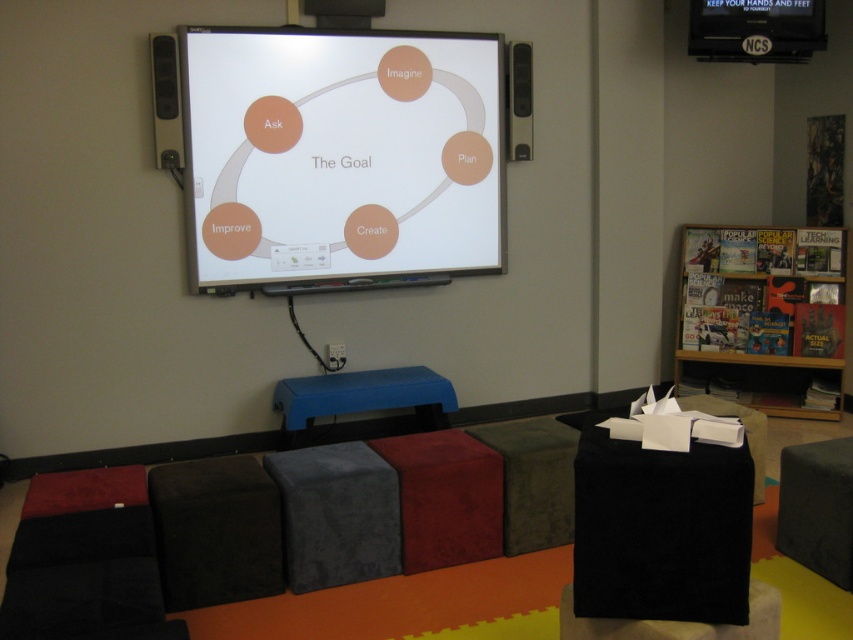
Between point (218, 147) and point (724, 42), which one is positioned in front?

Point (218, 147) is more forward.

At what (x,y) coordinates should I click in order to perform the action: click on white glossy projection screen at upper center. Please return your answer as a coordinate pair (x, y). The width and height of the screenshot is (853, 640). Looking at the image, I should click on (340, 154).

Where is `white glossy projection screen at upper center`? white glossy projection screen at upper center is located at coordinates (340, 154).

Is black fabric hassock at upper right shorter than blue rubber stool at center?

Indeed, black fabric hassock at upper right has a lesser height compared to blue rubber stool at center.

Does point (805, 12) come in front of point (306, 385)?

No, (805, 12) is behind (306, 385).

Find the location of `black fabric hassock at upper right`. black fabric hassock at upper right is located at coordinates (755, 29).

Who is more forward, (407, 131) or (447, 387)?

Point (447, 387) is in front.

Does white glossy projection screen at upper center have a smaller size compared to blue rubber stool at center?

Actually, white glossy projection screen at upper center might be larger than blue rubber stool at center.

Measure the distance between white glossy projection screen at upper center and camera.

white glossy projection screen at upper center is 3.90 meters away from camera.

Where is `white glossy projection screen at upper center`? white glossy projection screen at upper center is located at coordinates (340, 154).